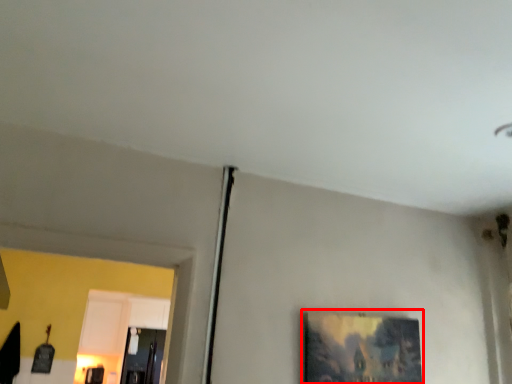
Question: From the image, what is the correct spatial relationship of picture frame (annotated by the red box) in relation to glass door?

Choices:
 (A) left
 (B) right

Answer: (B)